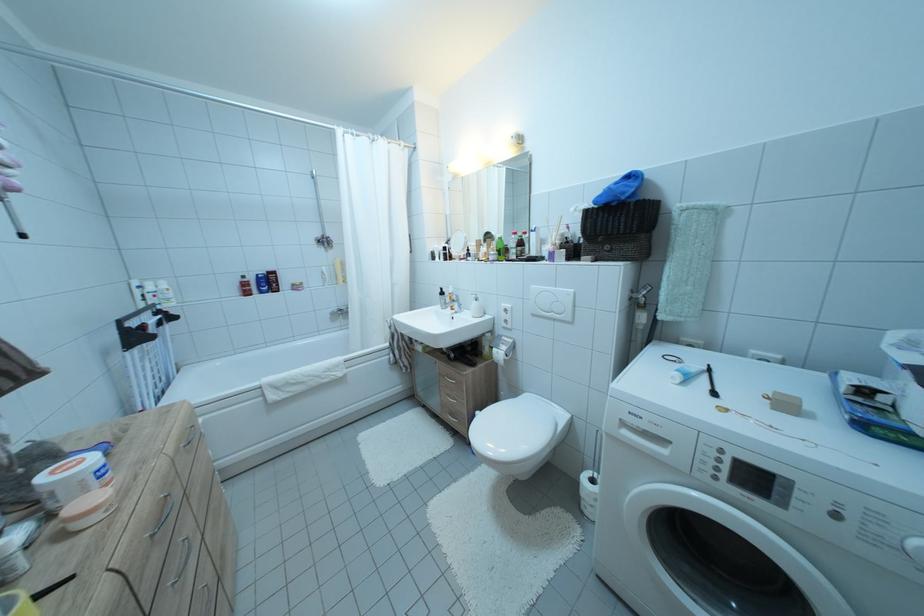
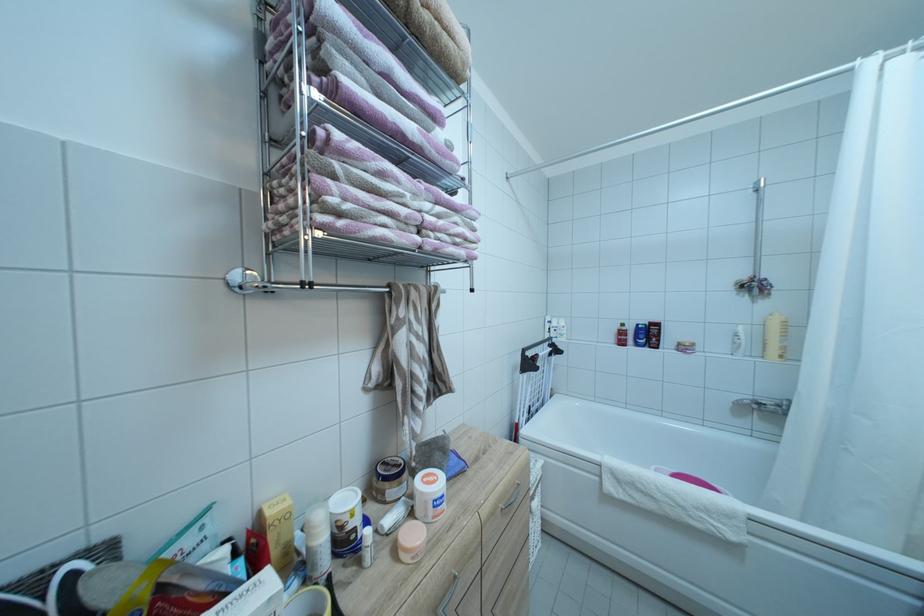
The point at (89, 467) is marked in the first image. Where is the corresponding point in the second image?

(442, 487)